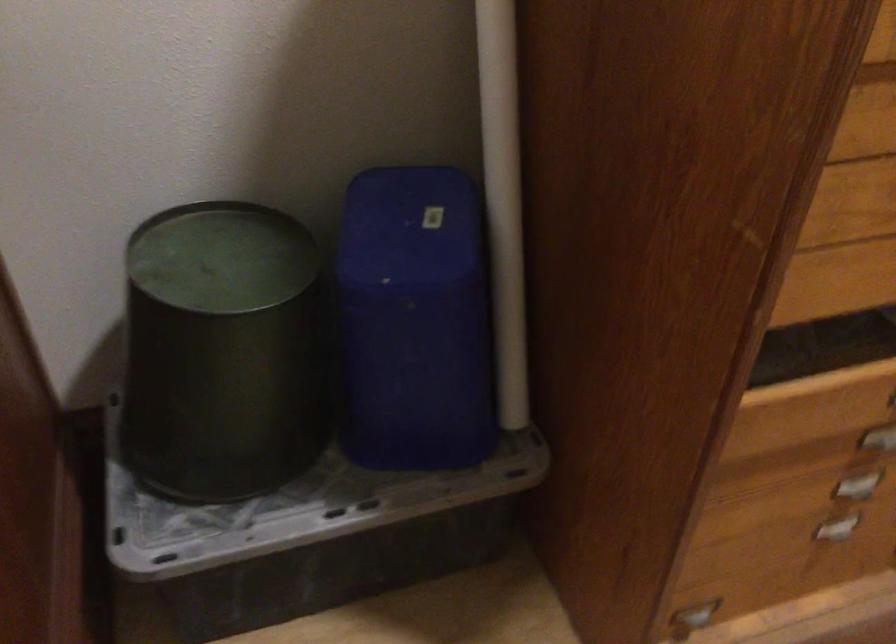
You are a GUI agent. You are given a task and a screenshot of the screen. Output one action in this format:
    pyautogui.click(x=<x>, y=<y>)
    Task: Click on the green round bin
    Image resolution: width=896 pixels, height=644 pixels.
    Given the screenshot: What is the action you would take?
    pyautogui.click(x=222, y=352)